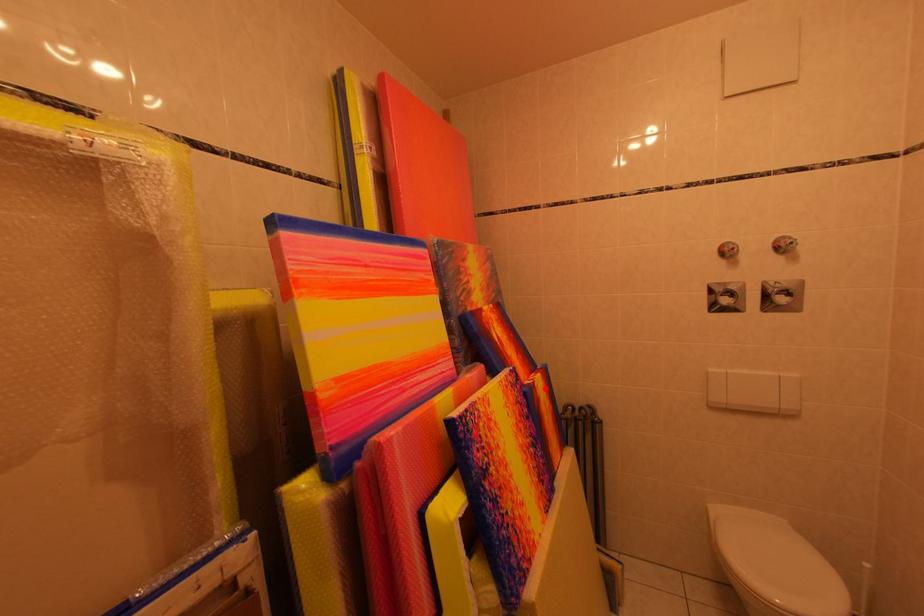
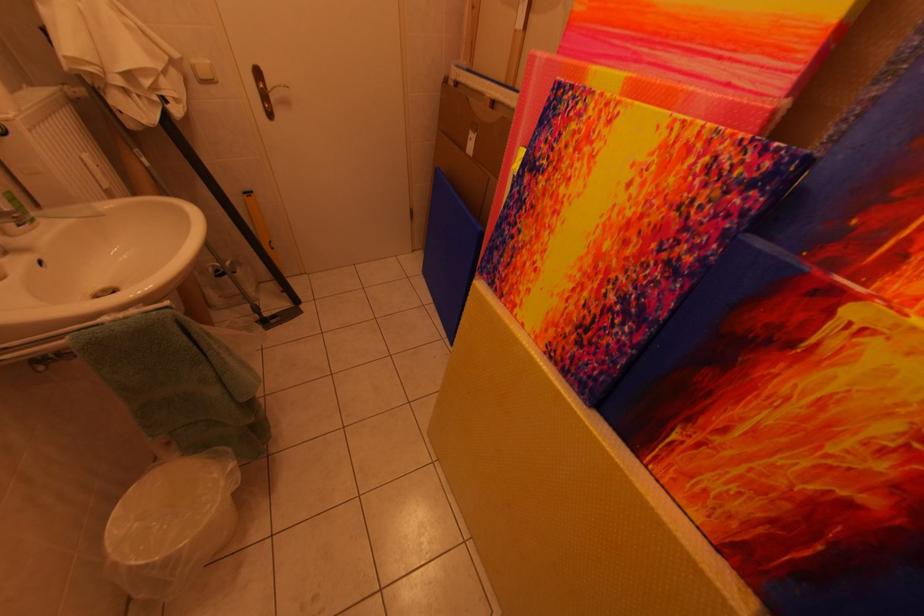
The point at the highlighted location is marked in the first image. Where is the corresponding point in the second image?

(861, 317)